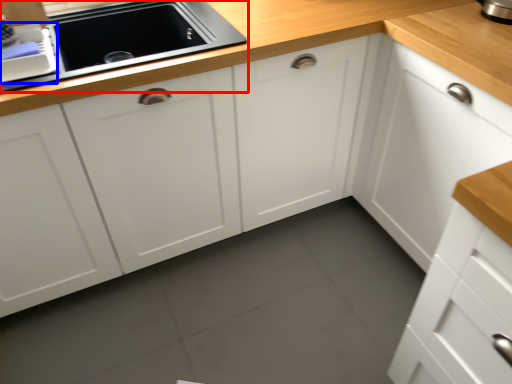
Question: Which object is closer to the camera taking this photo, home appliance (highlighted by a red box) or appliance (highlighted by a blue box)?

Choices:
 (A) home appliance
 (B) appliance

Answer: (B)